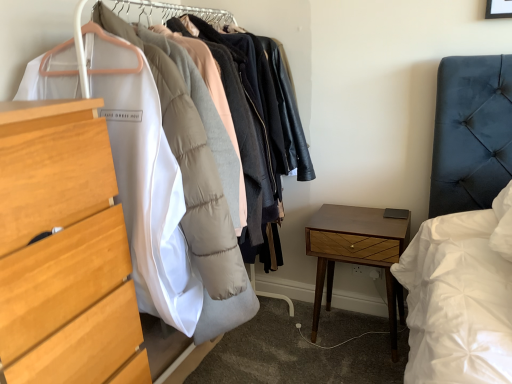
Find the location of `vacant region in front of wooden nightstand at lower right`. vacant region in front of wooden nightstand at lower right is located at coordinates (354, 363).